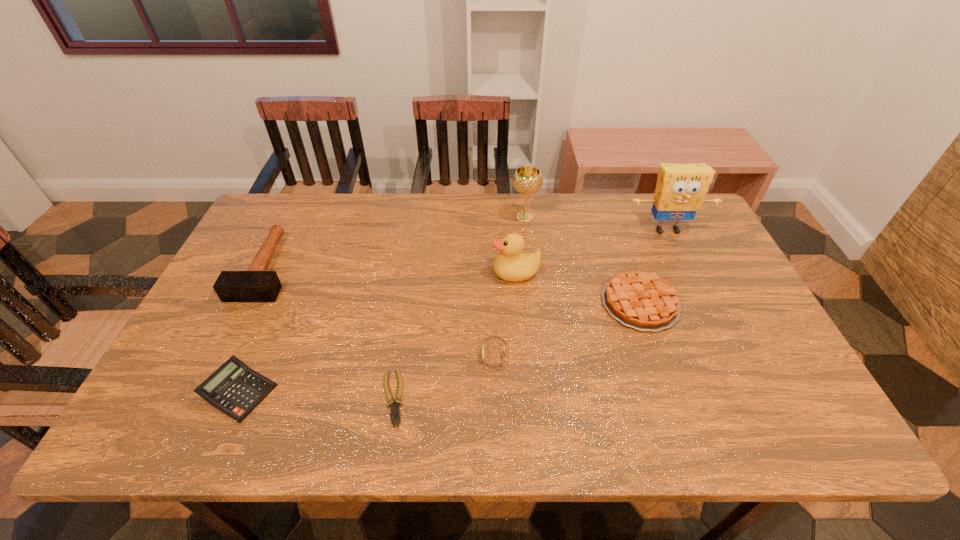
The image size is (960, 540). In order to click on vacant space located 0.080m on the front of the seventh shortest object in this screenshot , I will do `click(527, 242)`.

At what (x,y) coordinates should I click in order to perform the action: click on vacant area situated at the beak of the duck. Please return your answer as a coordinate pair (x, y). Looking at the image, I should click on (427, 273).

Locate an element on the screen. vacant space positioned at the beak of the duck is located at coordinates (383, 273).

Identify the location of vacant space located 0.110m at the beak of the duck. (455, 273).

I want to click on free space located 0.370m on the hammer head face of the fifth shortest object, so click(184, 432).

Find the location of a particular element. The width and height of the screenshot is (960, 540). free region located 0.240m on the back of the pie is located at coordinates (613, 225).

Identify the location of blank area located 0.080m on the face of the watch. (449, 355).

The height and width of the screenshot is (540, 960). I want to click on free location located on the face of the watch, so click(x=462, y=355).

I want to click on free location located on the face of the watch, so 441,355.

I want to click on vacant space located 0.290m on the right of the calculator, so click(x=401, y=392).